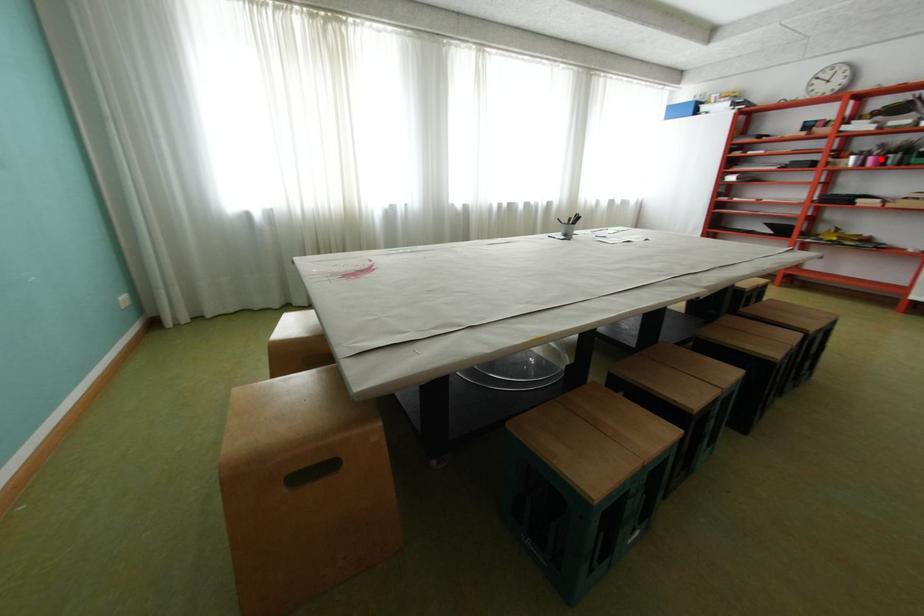
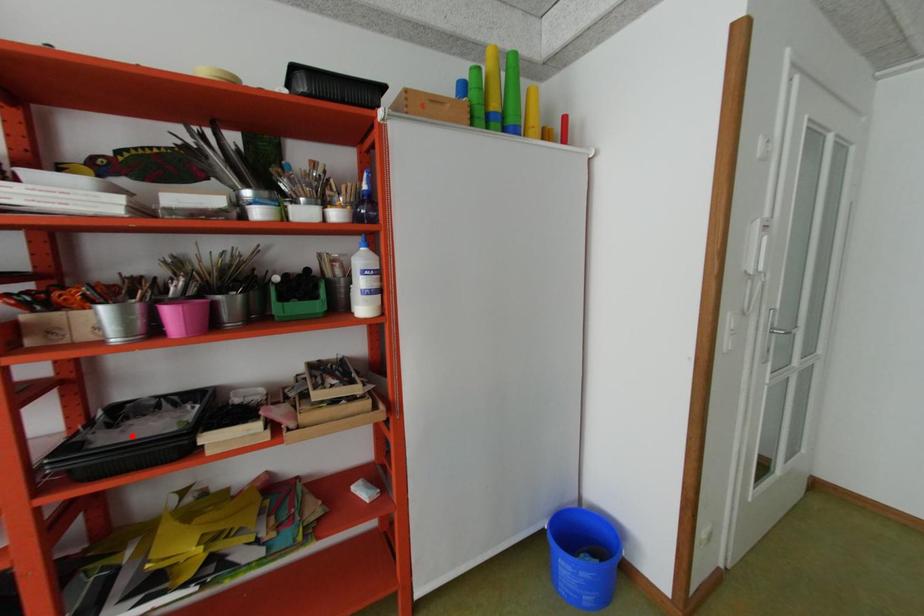
I am providing you with two images of the same scene from different viewpoints. A red point is marked on the first image and another point is marked on the second image. Are the points marked in image1 and image2 representing the same 3D position?

No